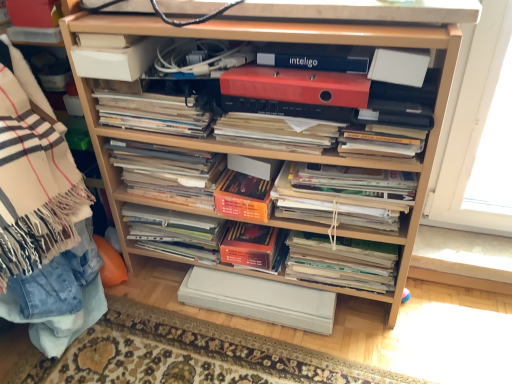
You are a GUI agent. You are given a task and a screenshot of the screen. Output one action in this format:
    pyautogui.click(x=<x>, y=<y>)
    Task: Click on the vacant space that is to the left of matte orange paperback book at center, which appears as the seventh paperback book when viewed from the top
    The height and width of the screenshot is (384, 512).
    Given the screenshot: What is the action you would take?
    pyautogui.click(x=156, y=326)